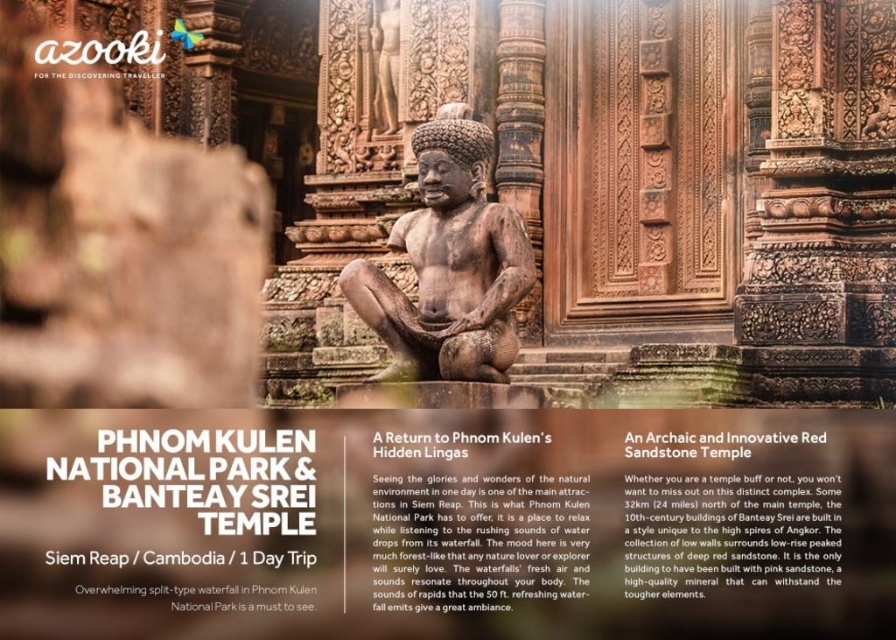
Question: Does matte sandstone statue at center have a smaller size compared to brown stone statue at center?

Choices:
 (A) yes
 (B) no

Answer: (A)

Question: Among these objects, which one is farthest from the camera?

Choices:
 (A) matte sandstone statue at center
 (B) brown stone statue at center

Answer: (B)

Question: Which point is farther to the camera?

Choices:
 (A) brown stone statue at center
 (B) matte sandstone statue at center

Answer: (A)

Question: Considering the relative positions of matte sandstone statue at center and brown stone statue at center in the image provided, where is matte sandstone statue at center located with respect to brown stone statue at center?

Choices:
 (A) above
 (B) below

Answer: (B)

Question: Is the position of matte sandstone statue at center more distant than that of brown stone statue at center?

Choices:
 (A) no
 (B) yes

Answer: (A)